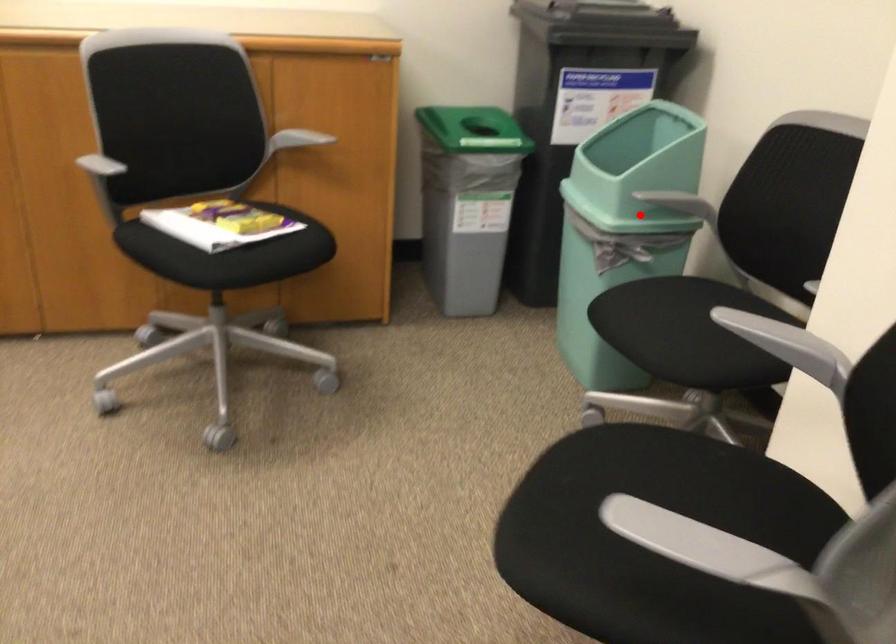
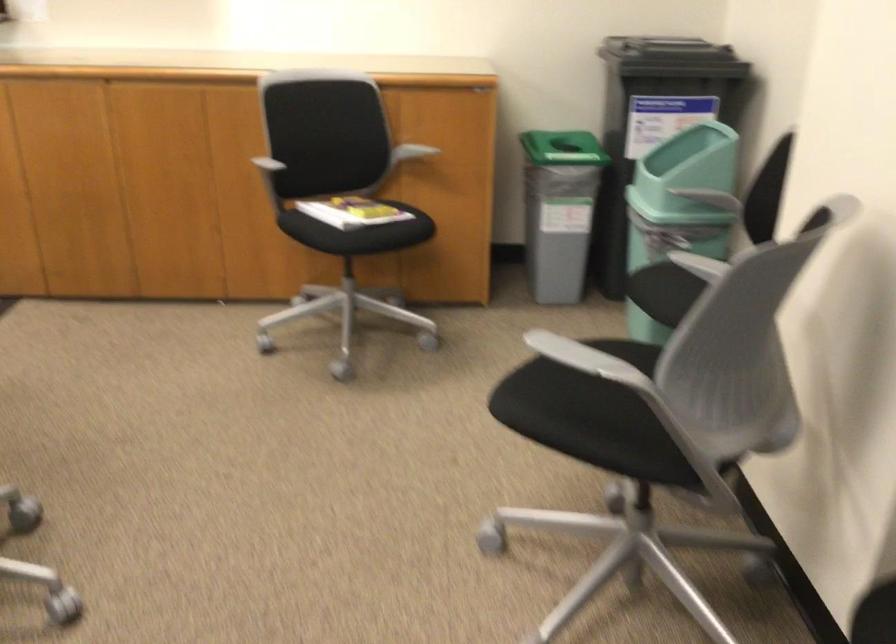
In the second image, find the point that corresponds to the highlighted location in the first image.

(678, 207)